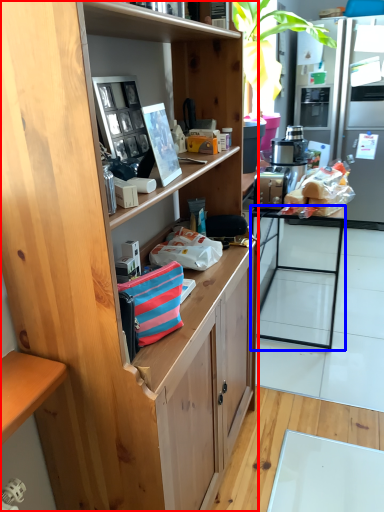
Question: Among these objects, which one is nearest to the camera, cabinetry (highlighted by a red box) or desk (highlighted by a blue box)?

Choices:
 (A) cabinetry
 (B) desk

Answer: (A)